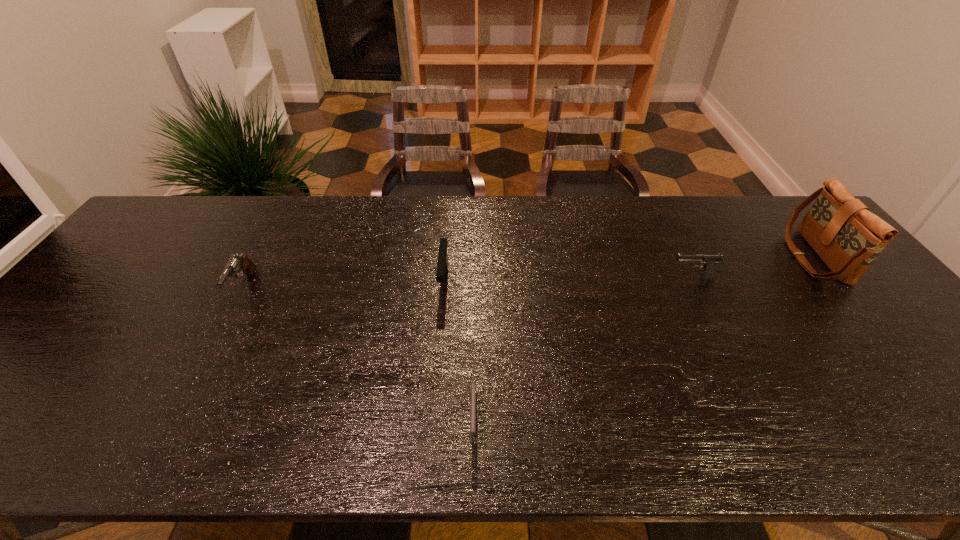
Identify the location of free space in the image that satisfies the following two spatial constraints: 1. aim along the barrel of the second object from right to left; 2. on the front-facing side of the fourth object from right to left. (694, 282).

The width and height of the screenshot is (960, 540). Identify the location of vacant region that satisfies the following two spatial constraints: 1. on the front-facing side of the tallest object; 2. at the barrel of the leftmost object. (838, 287).

Locate an element on the screen. The image size is (960, 540). vacant space that satisfies the following two spatial constraints: 1. aim along the barrel of the fourth object from left to right; 2. at the barrel of the third object from right to left is located at coordinates (763, 422).

Where is `blank space that satisfies the following two spatial constraints: 1. aim along the barrel of the second object from right to left; 2. on the front-facing side of the second pistol from left to right`? This screenshot has width=960, height=540. blank space that satisfies the following two spatial constraints: 1. aim along the barrel of the second object from right to left; 2. on the front-facing side of the second pistol from left to right is located at coordinates (694, 282).